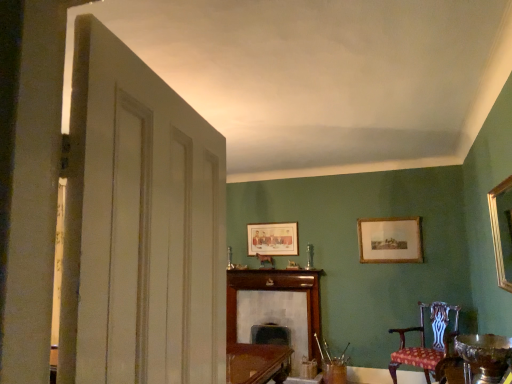
At what (x,y) coordinates should I click in order to perform the action: click on wooden fireplace at center. Please return your answer as a coordinate pair (x, y). This screenshot has width=512, height=384. Looking at the image, I should click on (270, 321).

Measure the distance between wooden fireplace at center and camera.

A distance of 5.27 meters exists between wooden fireplace at center and camera.

In order to face matte wooden picture frame at center, placed as the first picture frame when sorted from back to front, should I rotate leftwards or rightwards?

To align with it, rotate right about 2.183°.

At what (x,y) coordinates should I click in order to perform the action: click on shiny silver bowl at lower right. Please return your answer as a coordinate pair (x, y). This screenshot has height=384, width=512. Looking at the image, I should click on (484, 356).

Measure the distance between point (271,323) and camera.

Point (271,323) and camera are 5.71 meters apart from each other.

Image resolution: width=512 pixels, height=384 pixels. Describe the element at coordinates (390, 240) in the screenshot. I see `gold-framed print at upper right, which is the 2th picture frame from front to back` at that location.

The width and height of the screenshot is (512, 384). What are the coordinates of `gold wooden picture frame at upper right, the third picture frame in the back-to-front sequence` in the screenshot? It's located at (498, 232).

Based on the photo, is white painted wood door at left to the right of patterned fabric chair at lower right from the viewer's perspective?

In fact, white painted wood door at left is to the left of patterned fabric chair at lower right.

Which object is wider, white painted wood door at left or patterned fabric chair at lower right?

Wider between the two is patterned fabric chair at lower right.

Is the surface of white painted wood door at left in direct contact with patterned fabric chair at lower right?

No, white painted wood door at left is not touching patterned fabric chair at lower right.

Between point (209, 281) and point (424, 359), which one is positioned in front?

The point (209, 281) is in front.

From the image's perspective, which is above, white painted wood door at left or matte wooden picture frame at center, placed as the 3th picture frame when sorted from front to back?

white painted wood door at left appears higher in the image.

Based on the photo, can you tell me how much white painted wood door at left and matte wooden picture frame at center, placed as the 3th picture frame when sorted from front to back, differ in facing direction?

There is a 98.8-degree angle between the facing directions of white painted wood door at left and matte wooden picture frame at center, placed as the 3th picture frame when sorted from front to back.

Is white painted wood door at left aimed at matte wooden picture frame at center, marked as the 1th picture frame in a left-to-right arrangement?

No, white painted wood door at left is not turned towards matte wooden picture frame at center, marked as the 1th picture frame in a left-to-right arrangement.

Which is correct: white painted wood door at left is inside matte wooden picture frame at center, placed as the first picture frame when sorted from back to front, or outside of it?

white painted wood door at left is not enclosed by matte wooden picture frame at center, placed as the first picture frame when sorted from back to front.

From a real-world perspective, is white painted wood door at left positioned above or below shiny silver bowl at lower right?

From a real-world perspective, white painted wood door at left is physically above shiny silver bowl at lower right.

How different are the orientations of white painted wood door at left and shiny silver bowl at lower right in degrees?

white painted wood door at left and shiny silver bowl at lower right are facing 171 degrees away from each other.

Does white painted wood door at left touch shiny silver bowl at lower right?

white painted wood door at left and shiny silver bowl at lower right are clearly separated.

Is wooden fireplace at center at the back of shiny silver bowl at lower right?

No, wooden fireplace at center is not at the back of shiny silver bowl at lower right.

Can you confirm if shiny silver bowl at lower right is shorter than wooden fireplace at center?

Correct, shiny silver bowl at lower right is not as tall as wooden fireplace at center.

This screenshot has height=384, width=512. Identify the location of fireplace that appears below the shiny silver bowl at lower right (from the image's perspective). (270, 321).

Which object is further away from the camera, shiny silver bowl at lower right or wooden fireplace at center?

wooden fireplace at center is more distant.

Considering the relative sizes of patterned fabric chair at lower right and matte wooden picture frame at center, placed as the first picture frame when sorted from back to front, in the image provided, is patterned fabric chair at lower right smaller than matte wooden picture frame at center, placed as the first picture frame when sorted from back to front,?

Actually, patterned fabric chair at lower right might be larger than matte wooden picture frame at center, placed as the first picture frame when sorted from back to front.

Considering the positions of objects patterned fabric chair at lower right and matte wooden picture frame at center, placed as the 3th picture frame when sorted from front to back, in the image provided, who is more to the right, patterned fabric chair at lower right or matte wooden picture frame at center, placed as the 3th picture frame when sorted from front to back,?

From the viewer's perspective, patterned fabric chair at lower right appears more on the right side.

In the scene shown: What's the angular difference between patterned fabric chair at lower right and matte wooden picture frame at center, marked as the 1th picture frame in a left-to-right arrangement,'s facing directions?

32.5 degrees.

Is patterned fabric chair at lower right located outside matte wooden picture frame at center, placed as the 3th picture frame when sorted from front to back?

Yes.

From a real-world perspective, does gold wooden picture frame at upper right, the third picture frame in the back-to-front sequence, sit lower than matte wooden picture frame at center, placed as the 3th picture frame when sorted from front to back?

Yes.

Is gold wooden picture frame at upper right, the second picture frame in the right-to-left sequence, with matte wooden picture frame at center, marked as the 1th picture frame in a left-to-right arrangement?

There is a gap between gold wooden picture frame at upper right, the second picture frame in the right-to-left sequence, and matte wooden picture frame at center, marked as the 1th picture frame in a left-to-right arrangement.

How much distance is there between gold wooden picture frame at upper right, the second picture frame in the right-to-left sequence, and matte wooden picture frame at center, the 3th picture frame positioned from the right?

gold wooden picture frame at upper right, the second picture frame in the right-to-left sequence, and matte wooden picture frame at center, the 3th picture frame positioned from the right, are 2.91 meters apart from each other.

Can matte wooden picture frame at center, marked as the 1th picture frame in a left-to-right arrangement, be found inside gold wooden picture frame at upper right, the second picture frame in the right-to-left sequence?

Definitely not — matte wooden picture frame at center, marked as the 1th picture frame in a left-to-right arrangement, is not inside gold wooden picture frame at upper right, the second picture frame in the right-to-left sequence.

From the image's perspective, which is above, dark brown leather swivel chair at center or gold wooden picture frame at upper right, the second picture frame in the right-to-left sequence?

gold wooden picture frame at upper right, the second picture frame in the right-to-left sequence, from the image's perspective.

From a real-world perspective, which is physically above, dark brown leather swivel chair at center or gold wooden picture frame at upper right, the second picture frame in the right-to-left sequence?

gold wooden picture frame at upper right, the second picture frame in the right-to-left sequence.

Measure the distance from dark brown leather swivel chair at center to gold wooden picture frame at upper right, the second picture frame in the right-to-left sequence.

9.95 feet.

From the picture: Which object is wider, dark brown leather swivel chair at center or gold wooden picture frame at upper right, the third picture frame in the back-to-front sequence?

dark brown leather swivel chair at center.

Where is `chair directly beneath the white painted wood door at left (from a real-world perspective)`? The image size is (512, 384). chair directly beneath the white painted wood door at left (from a real-world perspective) is located at coordinates (424, 340).

Which picture frame is the 3rd one when counting from the back of the white painted wood door at left? Please provide its 2D coordinates.

[(272, 239)]

Estimate the real-world distances between objects in this image. Which object is closer to wooden fireplace at center, dark brown leather swivel chair at center or gold wooden picture frame at upper right, the third picture frame in the back-to-front sequence?

The object closer to wooden fireplace at center is dark brown leather swivel chair at center.

From the image, which object appears to be nearer to gold wooden picture frame at upper right, the first picture frame positioned from the front, dark brown leather swivel chair at center or gold-framed print at upper right, which is the 2th picture frame from front to back?

gold-framed print at upper right, which is the 2th picture frame from front to back, is positioned closer to the anchor gold wooden picture frame at upper right, the first picture frame positioned from the front.

Which object lies nearer to the anchor point dark brown leather swivel chair at center, white painted wood door at left or shiny silver bowl at lower right?

shiny silver bowl at lower right.

Which object lies further to the anchor point white painted wood door at left, wooden fireplace at center or dark brown leather swivel chair at center?

dark brown leather swivel chair at center lies further to white painted wood door at left than the other object.

When comparing their distances from matte wooden picture frame at center, marked as the 1th picture frame in a left-to-right arrangement, does patterned fabric chair at lower right or gold-framed print at upper right, which is the 2th picture frame from front to back, seem closer?

Based on the image, gold-framed print at upper right, which is the 2th picture frame from front to back, appears to be nearer to matte wooden picture frame at center, marked as the 1th picture frame in a left-to-right arrangement.

When comparing their distances from matte wooden picture frame at center, marked as the 1th picture frame in a left-to-right arrangement, does gold-framed print at upper right, positioned as the third picture frame in left-to-right order, or gold wooden picture frame at upper right, the second picture frame in the right-to-left sequence, seem further?

Among the two, gold wooden picture frame at upper right, the second picture frame in the right-to-left sequence, is located further to matte wooden picture frame at center, marked as the 1th picture frame in a left-to-right arrangement.

Looking at the image, which one is located further to wooden fireplace at center, shiny silver bowl at lower right or matte wooden picture frame at center, placed as the first picture frame when sorted from back to front?

shiny silver bowl at lower right lies further to wooden fireplace at center than the other object.

Based on their spatial positions, is dark brown leather swivel chair at center or gold wooden picture frame at upper right, the third picture frame in the back-to-front sequence, further from gold-framed print at upper right, which is the 2th picture frame from front to back?

Based on the image, gold wooden picture frame at upper right, the third picture frame in the back-to-front sequence, appears to be further to gold-framed print at upper right, which is the 2th picture frame from front to back.

Locate an element on the screen. This screenshot has width=512, height=384. round table between white painted wood door at left and gold wooden picture frame at upper right, the second picture frame in the right-to-left sequence, in the horizontal direction is located at coordinates (484, 356).

Image resolution: width=512 pixels, height=384 pixels. What are the coordinates of `chair between shiny silver bowl at lower right and wooden fireplace at center from front to back` in the screenshot? It's located at (424, 340).

Locate an element on the screen. chair between gold wooden picture frame at upper right, the second picture frame positioned from the left, and wooden fireplace at center from front to back is located at coordinates (424, 340).

Identify the location of picture frame located between gold wooden picture frame at upper right, the third picture frame in the back-to-front sequence, and wooden fireplace at center in the depth direction. (390, 240).